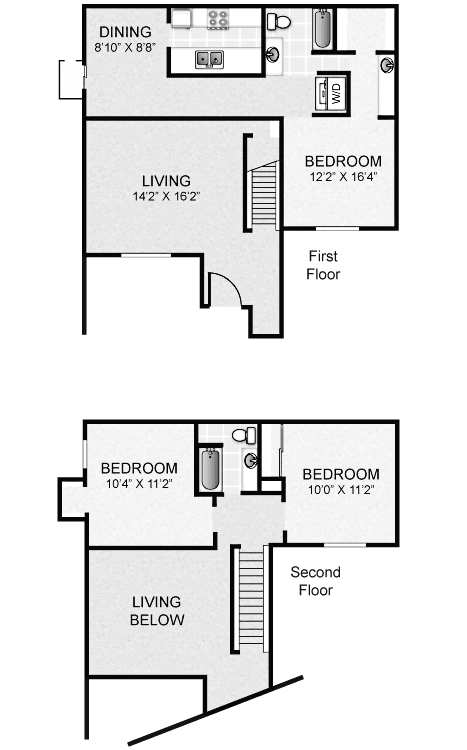
Locate an element on the screen. The width and height of the screenshot is (467, 750). windows is located at coordinates (157, 256), (340, 226), (84, 456), (346, 544).